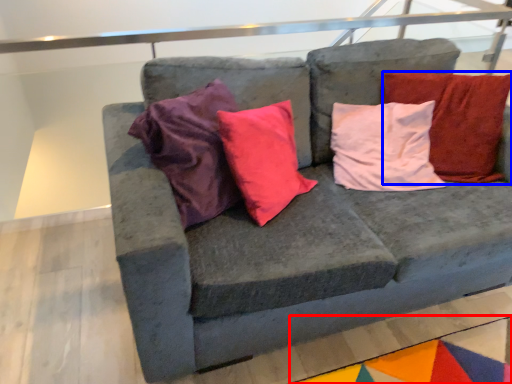
Question: Which object appears farthest to the camera in this image, mat (highlighted by a red box) or pillow (highlighted by a blue box)?

Choices:
 (A) mat
 (B) pillow

Answer: (B)